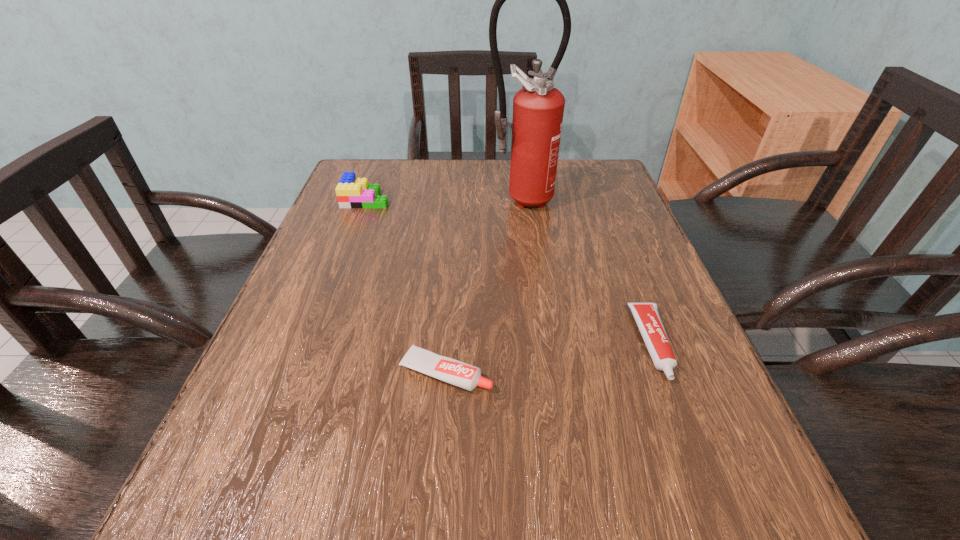
In the image, there is a desktop. Identify the location of vacant space at the near right corner. The height and width of the screenshot is (540, 960). (764, 514).

Where is `vacant point located between the fire extinguisher and the left toothpaste`? The width and height of the screenshot is (960, 540). vacant point located between the fire extinguisher and the left toothpaste is located at coordinates (483, 286).

Identify the location of free space between the Lego and the tallest object. The height and width of the screenshot is (540, 960). (443, 199).

Find the location of a particular element. The width and height of the screenshot is (960, 540). vacant region between the left toothpaste and the fire extinguisher is located at coordinates (483, 286).

Find the location of a particular element. free space between the right toothpaste and the second tallest object is located at coordinates (510, 272).

Where is `vacant region between the fire extinguisher and the right toothpaste`? vacant region between the fire extinguisher and the right toothpaste is located at coordinates (587, 272).

Identify the location of vacant region between the left toothpaste and the Lego. (406, 286).

Locate an element on the screen. unoccupied position between the rightmost object and the tallest object is located at coordinates (587, 272).

This screenshot has width=960, height=540. I want to click on unoccupied position between the Lego and the tallest object, so click(443, 199).

You are a GUI agent. You are given a task and a screenshot of the screen. Output one action in this format:
    pyautogui.click(x=<x>, y=<y>)
    Task: Click on the free space between the leftmost object and the left toothpaste
    
    Given the screenshot: What is the action you would take?
    pyautogui.click(x=406, y=286)